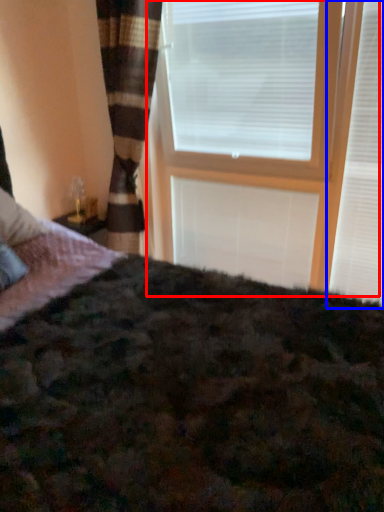
Question: Which object appears farthest to the camera in this image, window frame (highlighted by a red box) or window blind (highlighted by a blue box)?

Choices:
 (A) window frame
 (B) window blind

Answer: (B)